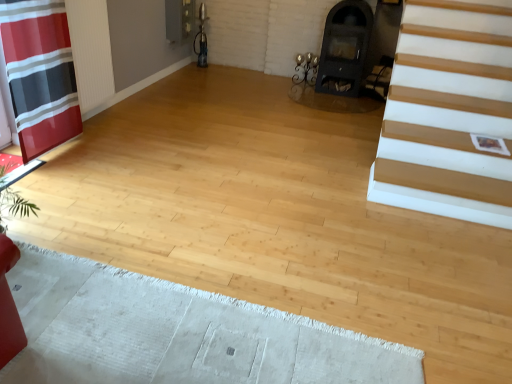
In order to face white textured rug at lower left, should I rotate leftwards or rightwards?

To face it directly, rotate left by 12.088 degrees.

Measure the distance between white textured rug at lower left and camera.

They are 1.51 meters apart.

This screenshot has height=384, width=512. What do you see at coordinates (344, 48) in the screenshot? I see `black matte fireplace at upper center` at bounding box center [344, 48].

Find the location of a particular element. The image size is (512, 384). matte black armchair at center is located at coordinates (379, 78).

Find the location of a particular element. The width and height of the screenshot is (512, 384). white textured rug at lower left is located at coordinates (176, 333).

Is red striped fabric at left aimed at black matte fireplace at upper center?

No, red striped fabric at left is not oriented towards black matte fireplace at upper center.

Is point (29, 30) closer or farther from the camera than point (364, 62)?

Point (29, 30) is closer to the camera than point (364, 62).

Can you confirm if red striped fabric at left is thinner than black matte fireplace at upper center?

Indeed, red striped fabric at left has a lesser width compared to black matte fireplace at upper center.

From a real-world perspective, between red striped fabric at left and black matte fireplace at upper center, who is vertically higher?

In real-world perspective, red striped fabric at left is above.

Looking at this image, are black matte fireplace at upper center and red striped fabric at left beside each other?

No, black matte fireplace at upper center is not touching red striped fabric at left.

Is black matte fireplace at upper center bigger than red striped fabric at left?

Correct, black matte fireplace at upper center is larger in size than red striped fabric at left.

Consider the image. Is black matte fireplace at upper center positioned with its back to red striped fabric at left?

black matte fireplace at upper center is not turned away from red striped fabric at left.

Can you confirm if black matte fireplace at upper center is thinner than red striped fabric at left?

In fact, black matte fireplace at upper center might be wider than red striped fabric at left.

Is point (210, 323) positioned in front of point (379, 62)?

Yes, point (210, 323) is closer to viewer.

Considering the sizes of white textured rug at lower left and matte black armchair at center in the image, is white textured rug at lower left taller or shorter than matte black armchair at center?

In the image, white textured rug at lower left appears to be shorter than matte black armchair at center.

From the image's perspective, does white textured rug at lower left appear higher than matte black armchair at center?

Incorrect, from the image's perspective, white textured rug at lower left is lower than matte black armchair at center.

How different are the orientations of black matte fireplace at upper center and white textured rug at lower left in degrees?

The facing directions of black matte fireplace at upper center and white textured rug at lower left are 92 degrees apart.

Considering the positions of objects black matte fireplace at upper center and white textured rug at lower left in the image provided, who is behind, black matte fireplace at upper center or white textured rug at lower left?

black matte fireplace at upper center.

Considering the sizes of black matte fireplace at upper center and white textured rug at lower left in the image, is black matte fireplace at upper center bigger or smaller than white textured rug at lower left?

In the image, black matte fireplace at upper center appears to be larger than white textured rug at lower left.

Is black matte fireplace at upper center oriented towards white textured rug at lower left?

Yes, black matte fireplace at upper center faces towards white textured rug at lower left.

Considering the sizes of objects white textured rug at lower left and black matte fireplace at upper center in the image provided, who is shorter, white textured rug at lower left or black matte fireplace at upper center?

white textured rug at lower left is shorter.

Choose the correct answer: Is white textured rug at lower left inside black matte fireplace at upper center or outside it?

white textured rug at lower left is outside black matte fireplace at upper center.

From the image's perspective, who appears lower, white textured rug at lower left or black matte fireplace at upper center?

white textured rug at lower left, from the image's perspective.

How different are the orientations of white textured rug at lower left and black matte fireplace at upper center in degrees?

The facing directions of white textured rug at lower left and black matte fireplace at upper center are 92 degrees apart.

Who is more distant, red striped fabric at left or white textured rug at lower left?

red striped fabric at left.

Is red striped fabric at left not near white textured rug at lower left?

That's right, there is a large distance between red striped fabric at left and white textured rug at lower left.

From the image's perspective, who appears lower, red striped fabric at left or white textured rug at lower left?

white textured rug at lower left.

From a real-world perspective, which object rests below the other?

From a 3D spatial view, white textured rug at lower left is below.

In the scene shown: Can you tell me how much matte black armchair at center and red striped fabric at left differ in facing direction?

matte black armchair at center and red striped fabric at left are facing 88.8 degrees away from each other.

Can you confirm if matte black armchair at center is bigger than red striped fabric at left?

No, matte black armchair at center is not bigger than red striped fabric at left.

From a real-world perspective, which object stands above the other?

red striped fabric at left.

Which object is wider, matte black armchair at center or red striped fabric at left?

matte black armchair at center is wider.

Locate an element on the screen. The width and height of the screenshot is (512, 384). curtain located below the black matte fireplace at upper center (from the image's perspective) is located at coordinates (40, 73).

At what (x,y) coordinates should I click in order to perform the action: click on fireplace on the right of red striped fabric at left. Please return your answer as a coordinate pair (x, y). The height and width of the screenshot is (384, 512). Looking at the image, I should click on click(344, 48).

Which object lies further to the anchor point matte black armchair at center, black matte fireplace at upper center or white textured rug at lower left?

Among the two, white textured rug at lower left is located further to matte black armchair at center.

Based on their spatial positions, is red striped fabric at left or matte black armchair at center closer to white textured rug at lower left?

red striped fabric at left lies closer to white textured rug at lower left than the other object.

Looking at the image, which one is located closer to red striped fabric at left, white textured rug at lower left or matte black armchair at center?

white textured rug at lower left is closer to red striped fabric at left.

From the image, which object appears to be farther from white textured rug at lower left, red striped fabric at left or black matte fireplace at upper center?

Among the two, black matte fireplace at upper center is located further to white textured rug at lower left.

Based on their spatial positions, is black matte fireplace at upper center or red striped fabric at left further from white textured rug at lower left?

black matte fireplace at upper center is further to white textured rug at lower left.

When comparing their distances from matte black armchair at center, does red striped fabric at left or white textured rug at lower left seem further?

Based on the image, white textured rug at lower left appears to be further to matte black armchair at center.

When comparing their distances from black matte fireplace at upper center, does red striped fabric at left or white textured rug at lower left seem closer?

Based on the image, red striped fabric at left appears to be nearer to black matte fireplace at upper center.

Looking at the image, which one is located closer to matte black armchair at center, red striped fabric at left or black matte fireplace at upper center?

The object closer to matte black armchair at center is black matte fireplace at upper center.

Locate an element on the screen. The image size is (512, 384). curtain positioned between white textured rug at lower left and black matte fireplace at upper center from near to far is located at coordinates (40, 73).

In order to click on fireplace between red striped fabric at left and matte black armchair at center in this screenshot , I will do `click(344, 48)`.

Where is `curtain located between white textured rug at lower left and matte black armchair at center in the depth direction`? This screenshot has height=384, width=512. curtain located between white textured rug at lower left and matte black armchair at center in the depth direction is located at coordinates (40, 73).

You are a GUI agent. You are given a task and a screenshot of the screen. Output one action in this format:
    pyautogui.click(x=<x>, y=<y>)
    Task: Click on the fireplace positioned between white textured rug at lower left and matte black armchair at center from near to far
    The image size is (512, 384).
    Given the screenshot: What is the action you would take?
    pyautogui.click(x=344, y=48)